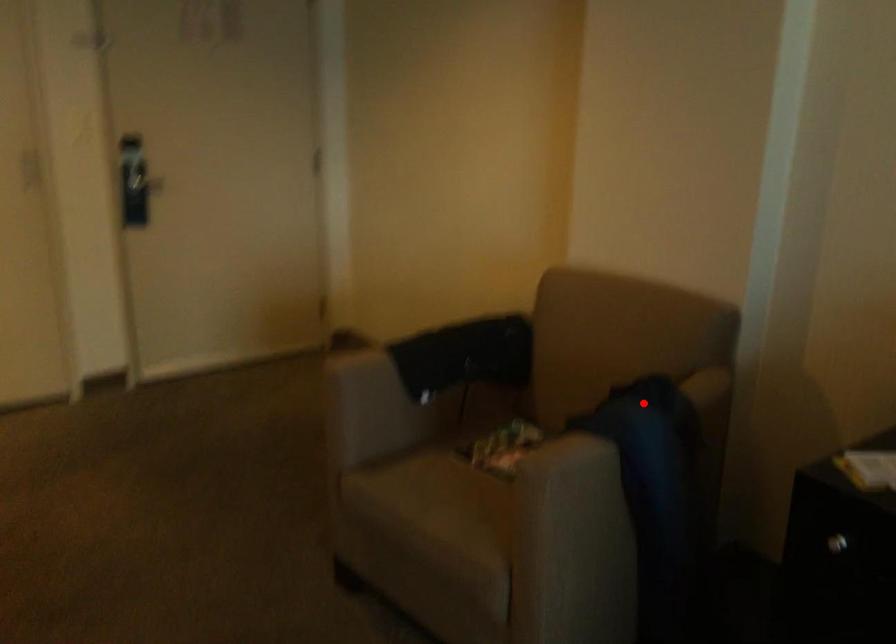
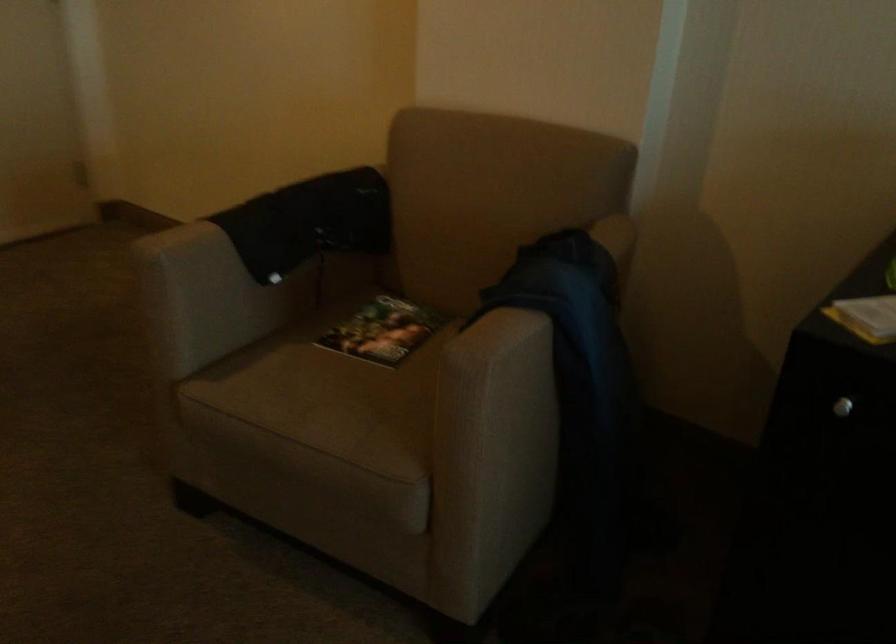
Where in the second image is the point corresponding to the highlighted location from the first image?

(564, 261)